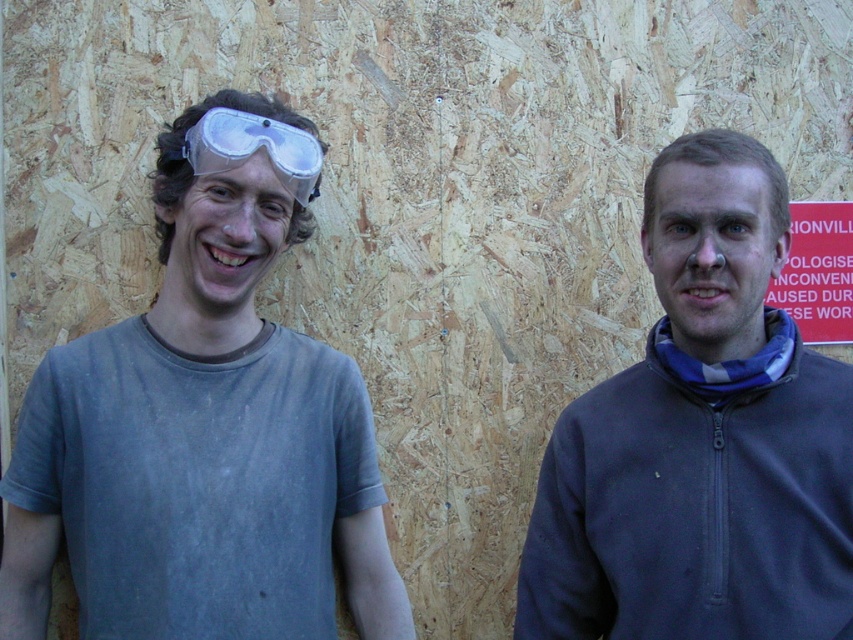
Can you confirm if gray matte t-shirt at left is positioned below transparent plastic goggles at left?

Indeed, gray matte t-shirt at left is positioned under transparent plastic goggles at left.

Can you confirm if gray matte t-shirt at left is taller than transparent plastic goggles at left?

Yes.

Where is `gray matte t-shirt at left`? The height and width of the screenshot is (640, 853). gray matte t-shirt at left is located at coordinates (206, 426).

Can you confirm if gray matte t-shirt at left is taller than red plastic sign at right?

Yes, gray matte t-shirt at left is taller than red plastic sign at right.

Between point (12, 632) and point (790, 301), which one is positioned behind?

The point (790, 301) is behind.

Find the location of a particular element. gray matte t-shirt at left is located at coordinates (206, 426).

From the picture: Can you confirm if red plastic sign at right is taller than transparent plastic goggles at left?

Yes.

Who is positioned more to the left, red plastic sign at right or transparent plastic goggles at left?

From the viewer's perspective, transparent plastic goggles at left appears more on the left side.

Is point (819, 253) positioned after point (233, 160)?

That is True.

The height and width of the screenshot is (640, 853). I want to click on red plastic sign at right, so click(817, 273).